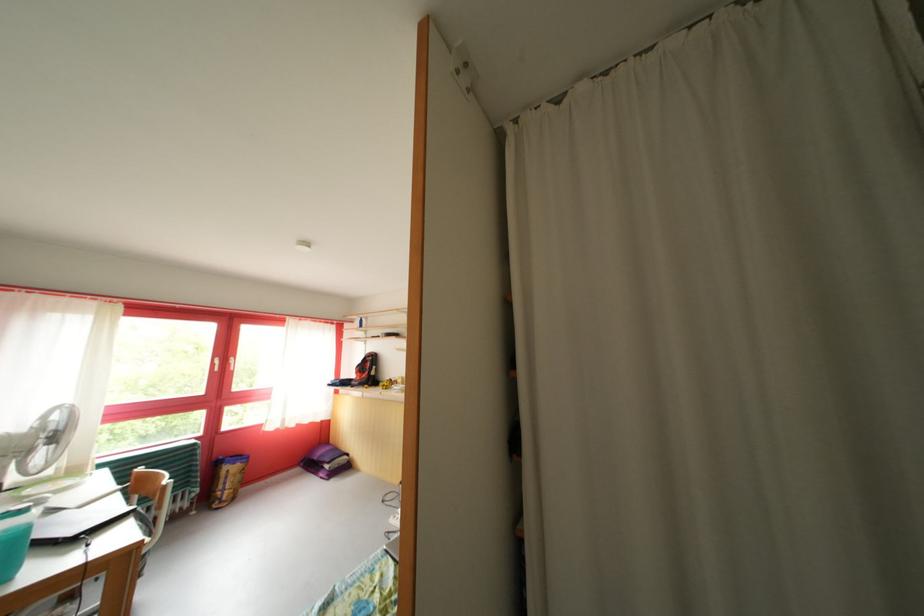
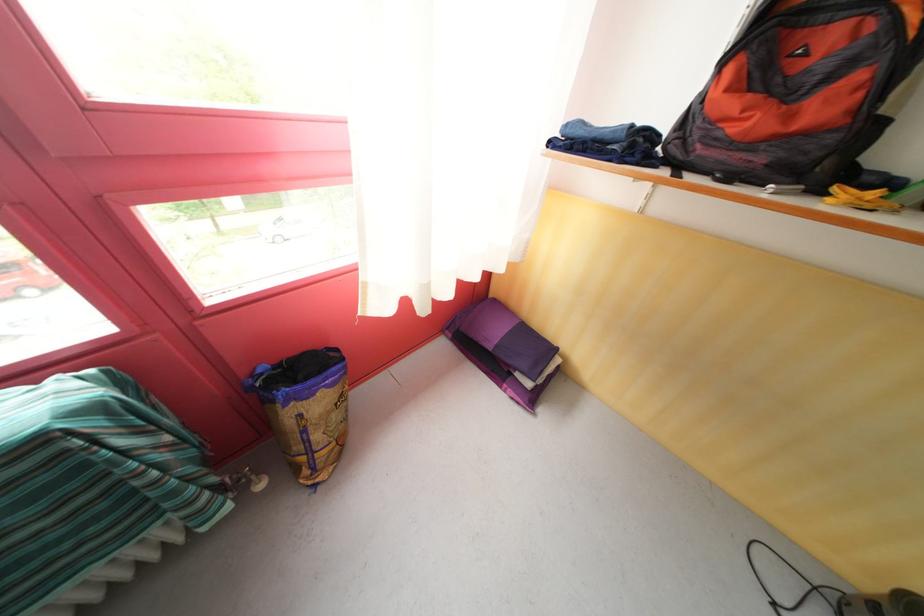
Where in the second image is the point corresponding to point 227,493 from the first image?

(305, 454)